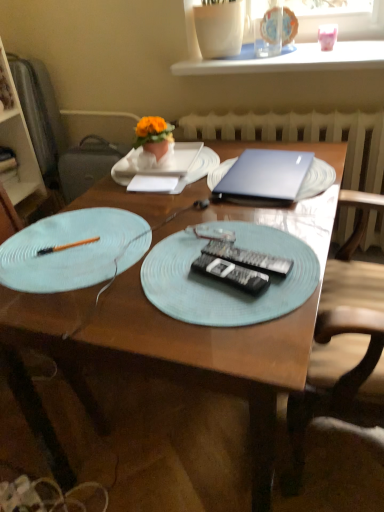
The height and width of the screenshot is (512, 384). I want to click on free space in front of light blue textured plate at left, placed as the second plate when sorted from front to back, so click(x=117, y=318).